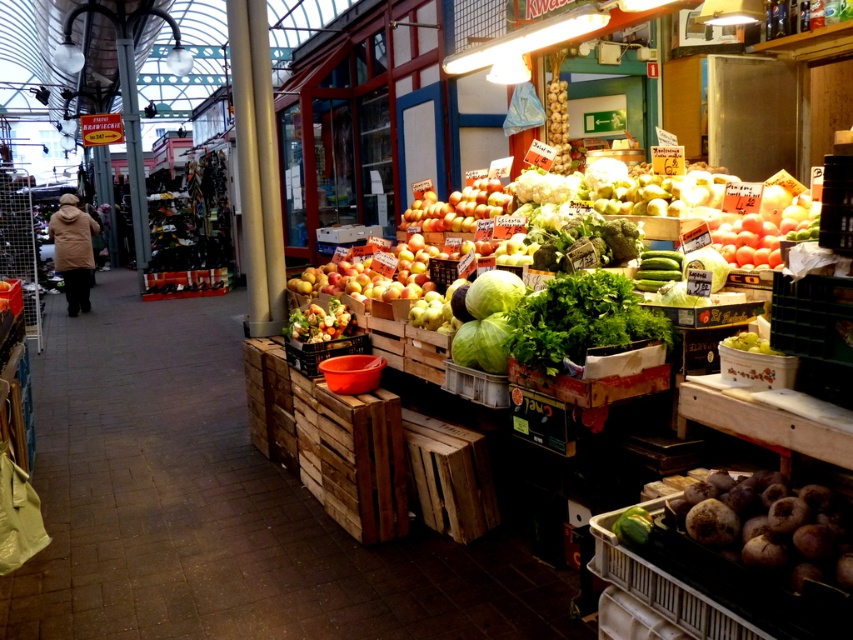
Question: Can you confirm if dark purple root at lower right is smaller than green leafymaterial/texturevegetable at center?

Choices:
 (A) no
 (B) yes

Answer: (B)

Question: Among these objects, which one is farthest from the camera?

Choices:
 (A) green leafymaterial/texturevegetable at center
 (B) green matte cucumber at lower right
 (C) shiny green leafy vegetables at center

Answer: (C)

Question: Is dark brown coat at left to the left of shiny green leafy vegetables at center from the viewer's perspective?

Choices:
 (A) no
 (B) yes

Answer: (B)

Question: Which object is the farthest from the dark brown coat at left?

Choices:
 (A) shiny green leafy vegetables at center
 (B) green leafymaterial/texturevegetable at center
 (C) green matte cucumber at lower right

Answer: (C)

Question: Which point is farther to the camera?

Choices:
 (A) green matte cucumber at lower right
 (B) shiny green leafy vegetables at center
 (C) green leafymaterial/texturevegetable at center

Answer: (B)

Question: Is shiny golden apples at center to the left of dark purple root at lower right from the viewer's perspective?

Choices:
 (A) no
 (B) yes

Answer: (B)